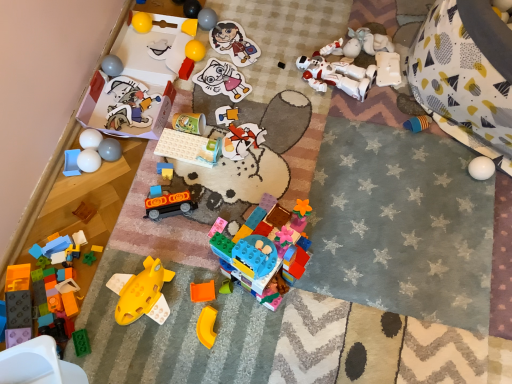
This screenshot has height=384, width=512. I want to click on yellow rubber ball at upper center, the tenth toy from the right, so click(x=195, y=50).

What do you see at coordinates (352, 64) in the screenshot? I see `white matte robot at center, marked as the third toy in a right-to-left arrangement` at bounding box center [352, 64].

The height and width of the screenshot is (384, 512). Describe the element at coordinates (61, 248) in the screenshot. I see `translucent blue plastic blocks at lower left, the first toy from the left` at that location.

The image size is (512, 384). Describe the element at coordinates (90, 139) in the screenshot. I see `white glossy balls at left, the 20th toy positioned from the right` at that location.

What do you see at coordinates (388, 68) in the screenshot? I see `white plastic robot at upper right, which appears as the second toy when viewed from the right` at bounding box center [388, 68].

Where is `yellow matte plastic piece at center, the seventeenth toy viewed from the left`? Image resolution: width=512 pixels, height=384 pixels. yellow matte plastic piece at center, the seventeenth toy viewed from the left is located at coordinates (206, 326).

Is white glossy balls at left, the 20th toy positioned from the right, at the left side of yellow rubber ball at upper left, which is the 8th toy in left-to-right order?

Indeed, white glossy balls at left, the 20th toy positioned from the right, is positioned on the left side of yellow rubber ball at upper left, which is the 8th toy in left-to-right order.

Considering the relative sizes of white glossy balls at left, arranged as the fourth toy when viewed from the left, and yellow rubber ball at upper left, the sixteenth toy from the right, in the image provided, is white glossy balls at left, arranged as the fourth toy when viewed from the left, wider than yellow rubber ball at upper left, the sixteenth toy from the right,?

Incorrect, the width of white glossy balls at left, arranged as the fourth toy when viewed from the left, does not surpass that of yellow rubber ball at upper left, the sixteenth toy from the right.

Considering the positions of objects white glossy balls at left, arranged as the fourth toy when viewed from the left, and yellow rubber ball at upper left, the sixteenth toy from the right, in the image provided, who is behind, white glossy balls at left, arranged as the fourth toy when viewed from the left, or yellow rubber ball at upper left, the sixteenth toy from the right,?

yellow rubber ball at upper left, the sixteenth toy from the right, is further from the camera.

Considering the relative positions of yellow rubber ball at upper center, which is the 14th toy from left to right, and white glossy balls at left, arranged as the fourth toy when viewed from the left, in the image provided, is yellow rubber ball at upper center, which is the 14th toy from left to right, to the left or to the right of white glossy balls at left, arranged as the fourth toy when viewed from the left,?

yellow rubber ball at upper center, which is the 14th toy from left to right, is positioned on white glossy balls at left, arranged as the fourth toy when viewed from the left,'s right side.

How distant is yellow rubber ball at upper center, the tenth toy from the right, from white glossy balls at left, arranged as the fourth toy when viewed from the left?

The distance of yellow rubber ball at upper center, the tenth toy from the right, from white glossy balls at left, arranged as the fourth toy when viewed from the left, is 17.56 inches.

Is yellow rubber ball at upper center, which is the 14th toy from left to right, bigger than white glossy balls at left, arranged as the fourth toy when viewed from the left?

Indeed, yellow rubber ball at upper center, which is the 14th toy from left to right, has a larger size compared to white glossy balls at left, arranged as the fourth toy when viewed from the left.

Where is `the 7th toy below the yellow rubber ball at upper center, which is the 14th toy from left to right (from the image's perspective)`? the 7th toy below the yellow rubber ball at upper center, which is the 14th toy from left to right (from the image's perspective) is located at coordinates (90, 139).

From the image's perspective, is glossy plastic ball at upper left, which appears as the eighteenth toy when viewed from the right, positioned above or below matte paper sticker at center, the eighteenth toy positioned from the left?

Clearly, from the image's perspective, glossy plastic ball at upper left, which appears as the eighteenth toy when viewed from the right, is above matte paper sticker at center, the eighteenth toy positioned from the left.

Which of these two, glossy plastic ball at upper left, which appears as the eighteenth toy when viewed from the right, or matte paper sticker at center, the eighteenth toy positioned from the left, is wider?

matte paper sticker at center, the eighteenth toy positioned from the left, is wider.

Considering the relative sizes of glossy plastic ball at upper left, which appears as the eighteenth toy when viewed from the right, and matte paper sticker at center, the eighteenth toy positioned from the left, in the image provided, is glossy plastic ball at upper left, which appears as the eighteenth toy when viewed from the right, shorter than matte paper sticker at center, the eighteenth toy positioned from the left,?

Incorrect, the height of glossy plastic ball at upper left, which appears as the eighteenth toy when viewed from the right, does not fall short of that of matte paper sticker at center, the eighteenth toy positioned from the left.

From a real-world perspective, relative to matte paper sticker at center, which appears as the 6th toy when viewed from the right, is glossy plastic ball at upper left, the sixth toy from the left, vertically above or below?

glossy plastic ball at upper left, the sixth toy from the left, is above matte paper sticker at center, which appears as the 6th toy when viewed from the right.

From a real-world perspective, who is located lower, yellow matte plastic piece at center, the seventh toy when ordered from right to left, or matte plastic sticker at upper center, which is the 20th toy from left to right?

In real-world perspective, matte plastic sticker at upper center, which is the 20th toy from left to right, is lower.

This screenshot has width=512, height=384. In order to click on the 19th toy positioned below the matte plastic sticker at upper center, marked as the fourth toy in a right-to-left arrangement (from the image's perspective) in this screenshot , I will do `click(206, 326)`.

Who is shorter, yellow matte plastic piece at center, the seventh toy when ordered from right to left, or matte plastic sticker at upper center, which is the 20th toy from left to right?

With less height is matte plastic sticker at upper center, which is the 20th toy from left to right.

I want to click on the 12th toy located beneath the white glossy ball at left, the nineteenth toy in the right-to-left sequence (from a real-world perspective), so click(85, 211).

Relative to wooden block at lower left, the 3th toy from the left, is white glossy ball at left, marked as the fifth toy in a left-to-right arrangement, in front or behind?

Clearly, white glossy ball at left, marked as the fifth toy in a left-to-right arrangement, is behind wooden block at lower left, the 3th toy from the left.

Based on the photo, does white glossy ball at left, the nineteenth toy in the right-to-left sequence, touch wooden block at lower left, the 3th toy from the left?

white glossy ball at left, the nineteenth toy in the right-to-left sequence, is not next to wooden block at lower left, the 3th toy from the left, and they're not touching.

From the image's perspective, who appears lower, blue plastic cup at left, the second toy when ordered from left to right, or matte plastic sticker at upper center, marked as the fourth toy in a right-to-left arrangement?

blue plastic cup at left, the second toy when ordered from left to right, is shown below in the image.

Considering the relative sizes of blue plastic cup at left, marked as the 22th toy in a right-to-left arrangement, and matte plastic sticker at upper center, marked as the fourth toy in a right-to-left arrangement, in the image provided, is blue plastic cup at left, marked as the 22th toy in a right-to-left arrangement, shorter than matte plastic sticker at upper center, marked as the fourth toy in a right-to-left arrangement,?

No, blue plastic cup at left, marked as the 22th toy in a right-to-left arrangement, is not shorter than matte plastic sticker at upper center, marked as the fourth toy in a right-to-left arrangement.

Measure the distance between blue plastic cup at left, the second toy when ordered from left to right, and matte plastic sticker at upper center, marked as the fourth toy in a right-to-left arrangement.

blue plastic cup at left, the second toy when ordered from left to right, is 64.53 centimeters from matte plastic sticker at upper center, marked as the fourth toy in a right-to-left arrangement.

From the picture: From a real-world perspective, who is located higher, blue plastic cup at left, the second toy when ordered from left to right, or matte plastic sticker at upper center, marked as the fourth toy in a right-to-left arrangement?

matte plastic sticker at upper center, marked as the fourth toy in a right-to-left arrangement, from a real-world perspective.

Based on the photo, is yellow matte block at center, which appears as the 13th toy when viewed from the right, positioned far away from translucent orange plastic at center, the fifth toy in the right-to-left sequence?

yellow matte block at center, which appears as the 13th toy when viewed from the right, is actually quite close to translucent orange plastic at center, the fifth toy in the right-to-left sequence.

Is translucent orange plastic at center, the fifth toy in the right-to-left sequence, a part of yellow matte block at center, which appears as the 13th toy when viewed from the right?

No, translucent orange plastic at center, the fifth toy in the right-to-left sequence, is not inside yellow matte block at center, which appears as the 13th toy when viewed from the right.

From the image's perspective, is yellow matte block at center, which appears as the 13th toy when viewed from the right, on top of translucent orange plastic at center, arranged as the nineteenth toy when viewed from the left?

Yes, from the image's perspective, yellow matte block at center, which appears as the 13th toy when viewed from the right, is above translucent orange plastic at center, arranged as the nineteenth toy when viewed from the left.

Which object is thinner, yellow matte block at center, which appears as the 13th toy when viewed from the right, or translucent orange plastic at center, arranged as the nineteenth toy when viewed from the left?

Thinner between the two is translucent orange plastic at center, arranged as the nineteenth toy when viewed from the left.

At what (x,y) coordinates should I click in order to perform the action: click on the 10th toy below when counting from the yellow rubber ball at upper left, the sixteenth toy from the right (from the image's perspective). Please return your answer as a coordinate pair (x, y). The height and width of the screenshot is (384, 512). Looking at the image, I should click on pyautogui.click(x=90, y=139).

Locate an element on the screen. This screenshot has width=512, height=384. the 7th toy above when counting from the white glossy balls at left, arranged as the fourth toy when viewed from the left (from the image's perspective) is located at coordinates (195, 50).

From the image, which object appears to be nearer to matte gray ball at upper left, the seventeenth toy in the right-to-left sequence, white plastic robot at upper right, arranged as the 22th toy when viewed from the left, or matte plastic sticker at upper center, marked as the fourth toy in a right-to-left arrangement?

matte plastic sticker at upper center, marked as the fourth toy in a right-to-left arrangement, lies closer to matte gray ball at upper left, the seventeenth toy in the right-to-left sequence, than the other object.

Which object lies further to the anchor point yellow rubber ball at upper left, the sixteenth toy from the right, smooth yellow ball at upper center, the ninth toy from the right, or white fabric tent at right, the 1th toy positioned from the right?

white fabric tent at right, the 1th toy positioned from the right, is further to yellow rubber ball at upper left, the sixteenth toy from the right.

Which object lies further to the anchor point white matte robot at center, marked as the third toy in a right-to-left arrangement, translucent orange plastic at center, the fifth toy in the right-to-left sequence, or wooden block at lower left, placed as the 21th toy when sorted from right to left?

The object further to white matte robot at center, marked as the third toy in a right-to-left arrangement, is wooden block at lower left, placed as the 21th toy when sorted from right to left.

Which object lies nearer to the anchor point translucent blue plastic blocks at lower left, the first toy from the left, translucent plastic building blocks at center, which is the 12th toy from left to right, or translucent orange plastic at center, the fifth toy in the right-to-left sequence?

Based on the image, translucent plastic building blocks at center, which is the 12th toy from left to right, appears to be nearer to translucent blue plastic blocks at lower left, the first toy from the left.

Which object lies further to the anchor point matte plastic blocks at center, the 9th toy viewed from the left, yellow rubber ball at upper center, which is the 14th toy from left to right, or wooden block at lower left, placed as the 21th toy when sorted from right to left?

yellow rubber ball at upper center, which is the 14th toy from left to right, is further to matte plastic blocks at center, the 9th toy viewed from the left.

When comparing their distances from translucent blue plastic blocks at lower left, which appears as the 23th toy when viewed from the right, does yellow matte block at center, which is counted as the eleventh toy, starting from the left, or translucent plastic building blocks at center, which is the 12th toy from left to right, seem further?

The object further to translucent blue plastic blocks at lower left, which appears as the 23th toy when viewed from the right, is yellow matte block at center, which is counted as the eleventh toy, starting from the left.

Based on their spatial positions, is yellow rubber ball at upper left, the sixteenth toy from the right, or white fabric tent at right, the 1th toy positioned from the right, further from white matte robot at center, marked as the third toy in a right-to-left arrangement?

The object further to white matte robot at center, marked as the third toy in a right-to-left arrangement, is yellow rubber ball at upper left, the sixteenth toy from the right.

Estimate the real-world distances between objects in this image. Which object is closer to wooden block at lower left, placed as the 21th toy when sorted from right to left, yellow rubber ball at upper left, which is the 8th toy in left-to-right order, or smooth yellow ball at upper center, the ninth toy from the right?

yellow rubber ball at upper left, which is the 8th toy in left-to-right order, lies closer to wooden block at lower left, placed as the 21th toy when sorted from right to left, than the other object.

You are a GUI agent. You are given a task and a screenshot of the screen. Output one action in this format:
    pyautogui.click(x=<x>, y=<y>)
    Task: Click on the toy between translucent orange plastic at center, arranged as the nineteenth toy when viewed from the left, and yellow matte plastic piece at center, the seventeenth toy viewed from the left, vertically
    
    Given the screenshot: What is the action you would take?
    pyautogui.click(x=202, y=292)

At what (x,y) coordinates should I click in order to perform the action: click on toy situated between matte plastic sticker at upper center, marked as the fourth toy in a right-to-left arrangement, and white plastic robot at upper right, which appears as the second toy when viewed from the right, from left to right. Please return your answer as a coordinate pair (x, y). The image size is (512, 384). Looking at the image, I should click on (352, 64).